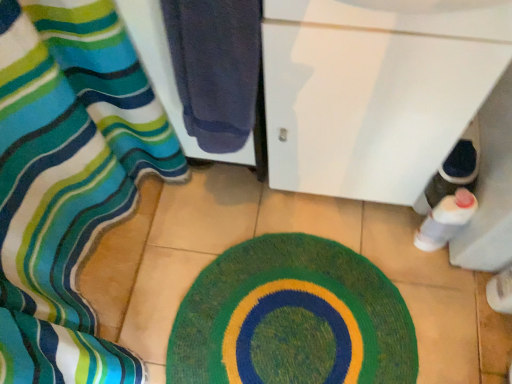
This screenshot has height=384, width=512. In order to click on free space in front of white glossy bottle at lower right in this screenshot , I will do `click(443, 303)`.